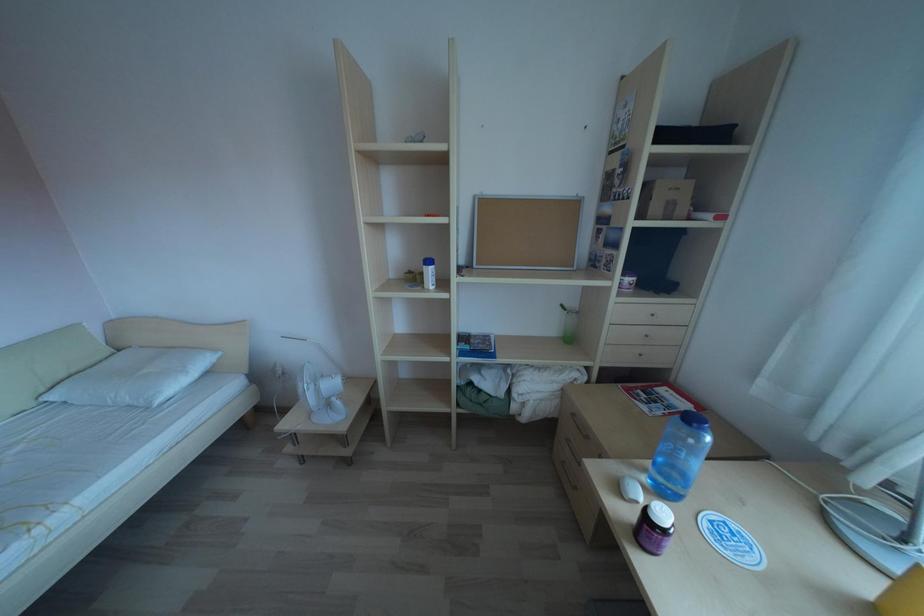
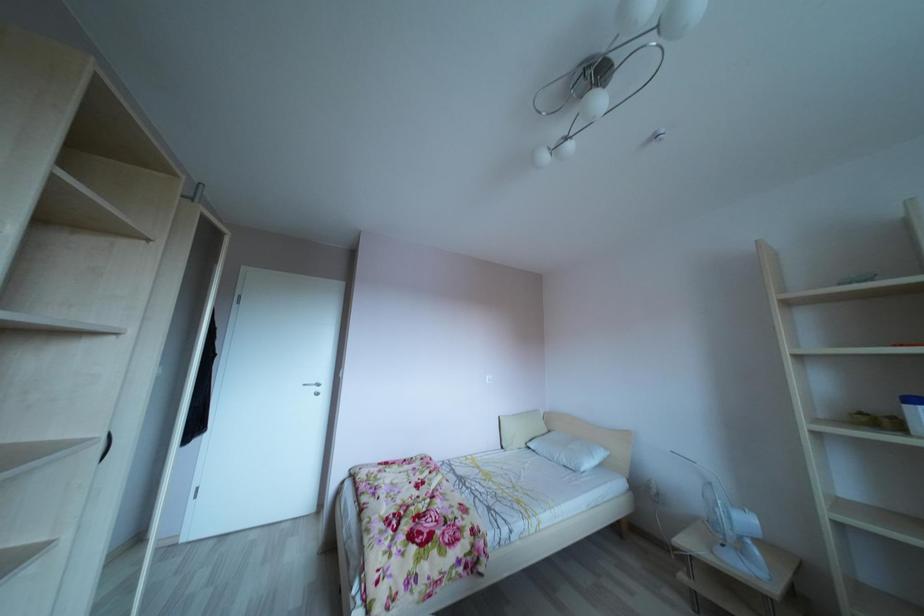
How did the camera likely rotate?

The camera rotated toward left-up.